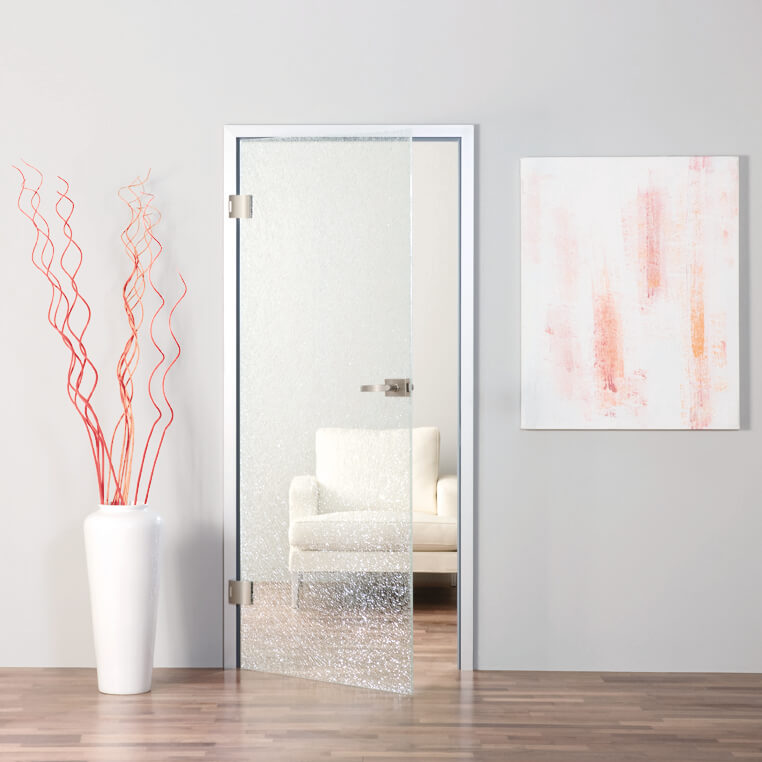
This screenshot has height=762, width=762. Find the location of `chair`. chair is located at coordinates (472, 258), (392, 492).